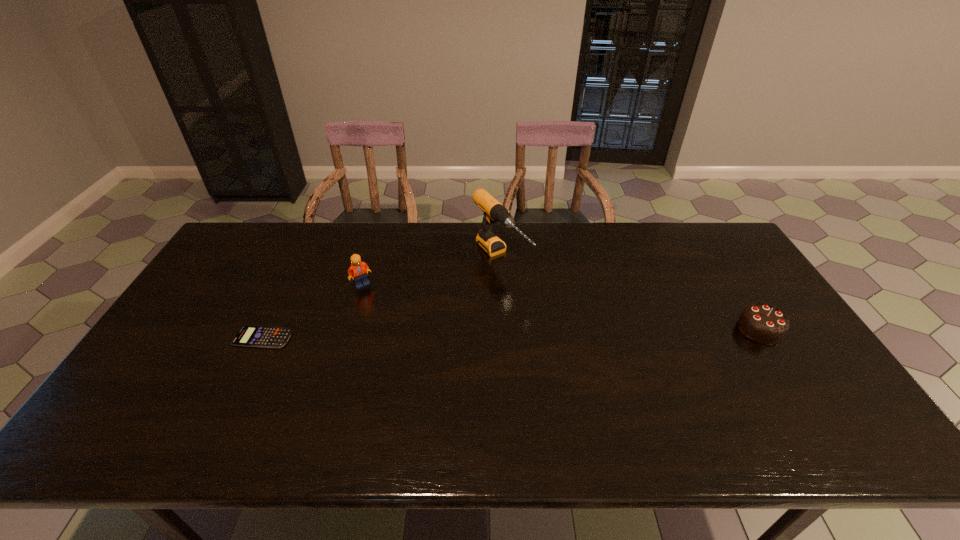
Locate an element on the screen. Image resolution: width=960 pixels, height=540 pixels. unoccupied area between the second object from left to right and the leftmost object is located at coordinates (313, 311).

Where is `free space between the tallest object and the second tallest object`? free space between the tallest object and the second tallest object is located at coordinates (431, 271).

The image size is (960, 540). Find the location of `vacant area that lies between the third object from left to right and the shortest object`. vacant area that lies between the third object from left to right and the shortest object is located at coordinates [x=382, y=298].

This screenshot has width=960, height=540. In order to click on empty space that is in between the third object from left to right and the Lego in this screenshot , I will do `click(431, 271)`.

Where is `unoccupied area between the shortest object and the second object from left to right`? unoccupied area between the shortest object and the second object from left to right is located at coordinates (313, 311).

Where is `object that stands as the closest to the calculator`? Image resolution: width=960 pixels, height=540 pixels. object that stands as the closest to the calculator is located at coordinates (359, 270).

Locate which object is the second closest to the tallest object. Please provide its 2D coordinates. Your answer should be formatted as a tuple, i.e. [(x, y)], where the tuple contains the x and y coordinates of a point satisfying the conditions above.

[(248, 336)]